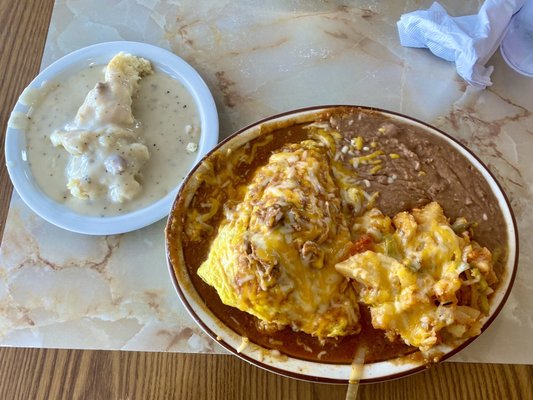
You are a GUI agent. You are given a task and a screenshot of the screen. Output one action in this format:
    pyautogui.click(x=<x>, y=<y>)
    Task: Click on the flatware
    The height and width of the screenshot is (400, 533).
    Given the screenshot: What is the action you would take?
    pyautogui.click(x=131, y=222), pyautogui.click(x=177, y=248)